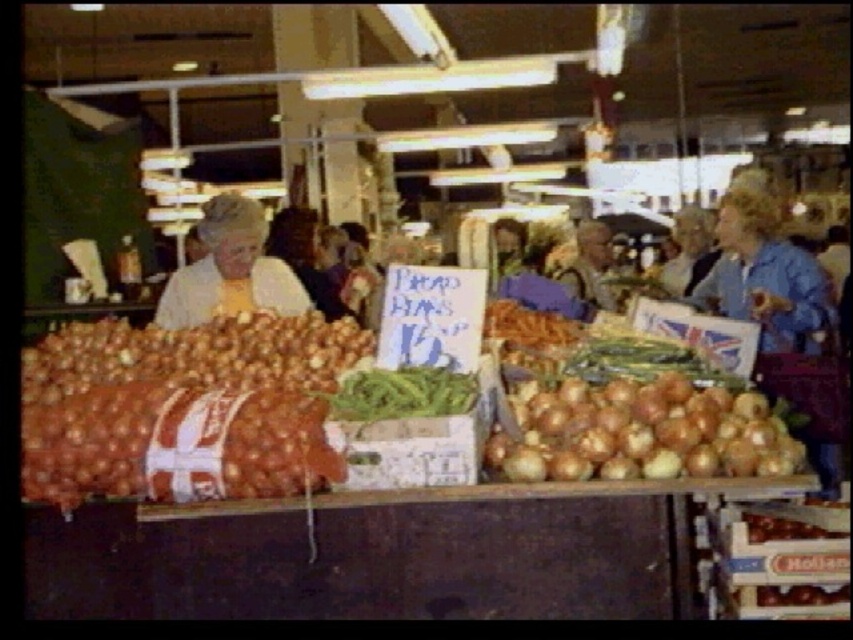
Question: Which of the following is the farthest from the observer?

Choices:
 (A) (196, 276)
 (B) (598, 332)

Answer: (A)

Question: Which point is closer to the camera?

Choices:
 (A) (430, 368)
 (B) (706, 442)
 (C) (312, 305)
 (D) (607, 349)

Answer: (B)

Question: From the image, what is the correct spatial relationship of smooth brown onion at center in relation to green matte asparagus at center?

Choices:
 (A) left
 (B) right

Answer: (A)

Question: Is matte brown onion at center further to camera compared to white fabric at center?

Choices:
 (A) no
 (B) yes

Answer: (A)

Question: Based on their relative distances, which object is nearer to the white fabric at center?

Choices:
 (A) green matte asparagus at center
 (B) brown matte carrots at center
 (C) matte brown onion at center
 (D) smooth brown onions at left

Answer: (D)

Question: Can you confirm if green matte beans at center is positioned below smooth brown hair at center?

Choices:
 (A) no
 (B) yes

Answer: (B)